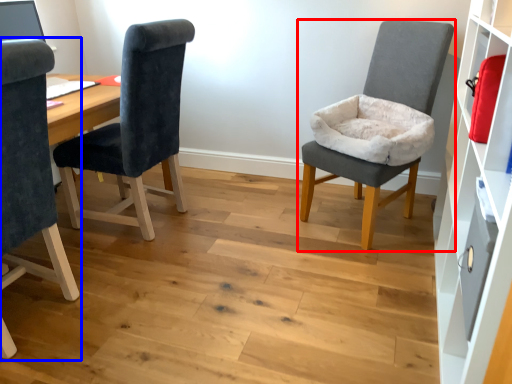
Question: Which of the following is the farthest to the observer, chair (highlighted by a red box) or chair (highlighted by a blue box)?

Choices:
 (A) chair
 (B) chair

Answer: (A)